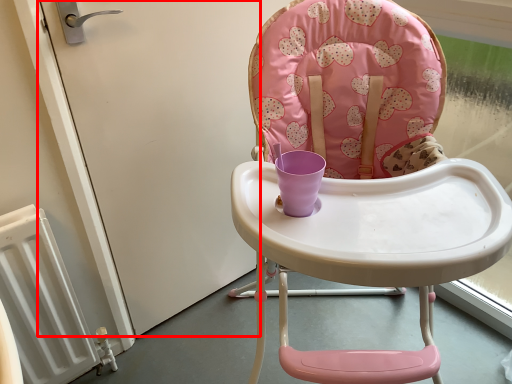
Question: From the image's perspective, where is screen door (annotated by the red box) located in relation to chair in the image?

Choices:
 (A) below
 (B) above

Answer: (B)